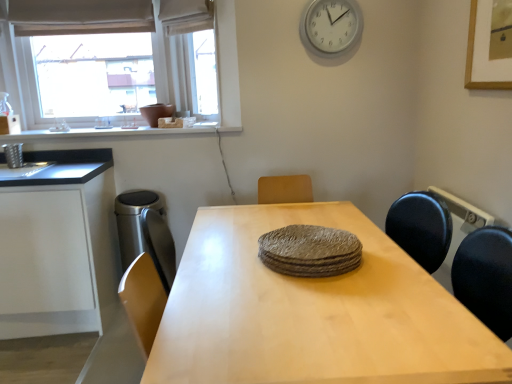
Question: From the image's perspective, is white plastic clock at upper center located beneath white matte window sill at upper left?

Choices:
 (A) no
 (B) yes

Answer: (A)

Question: From a real-world perspective, is white plastic clock at upper center on top of white matte window sill at upper left?

Choices:
 (A) yes
 (B) no

Answer: (A)

Question: Does white plastic clock at upper center come behind white matte window sill at upper left?

Choices:
 (A) no
 (B) yes

Answer: (A)

Question: Is white plastic clock at upper center turned away from white matte window sill at upper left?

Choices:
 (A) yes
 (B) no

Answer: (B)

Question: Does white plastic clock at upper center turn towards white matte window sill at upper left?

Choices:
 (A) no
 (B) yes

Answer: (A)

Question: From the image's perspective, is matte white window at upper left above or below white matte cabinet at left?

Choices:
 (A) above
 (B) below

Answer: (A)

Question: Would you say matte white window at upper left is inside or outside white matte cabinet at left?

Choices:
 (A) outside
 (B) inside

Answer: (A)

Question: Is point (233, 99) positioned closer to the camera than point (12, 284)?

Choices:
 (A) closer
 (B) farther

Answer: (B)

Question: Considering the relative positions of matte white window at upper left and white matte cabinet at left in the image provided, is matte white window at upper left to the left or to the right of white matte cabinet at left?

Choices:
 (A) left
 (B) right

Answer: (B)

Question: Does point (184, 132) appear closer or farther from the camera than point (158, 261)?

Choices:
 (A) farther
 (B) closer

Answer: (B)

Question: Based on their positions, is white matte window sill at upper left located to the left or right of satin silver trash can at left?

Choices:
 (A) left
 (B) right

Answer: (A)

Question: From a real-world perspective, is white matte window sill at upper left positioned above or below satin silver trash can at left?

Choices:
 (A) above
 (B) below

Answer: (A)

Question: Is white matte window sill at upper left wider or thinner than satin silver trash can at left?

Choices:
 (A) wide
 (B) thin

Answer: (A)

Question: Is light wood table at center to the left or to the right of satin silver trash can at left in the image?

Choices:
 (A) right
 (B) left

Answer: (A)

Question: Considering the positions of light wood table at center and satin silver trash can at left in the image, is light wood table at center wider or thinner than satin silver trash can at left?

Choices:
 (A) thin
 (B) wide

Answer: (B)